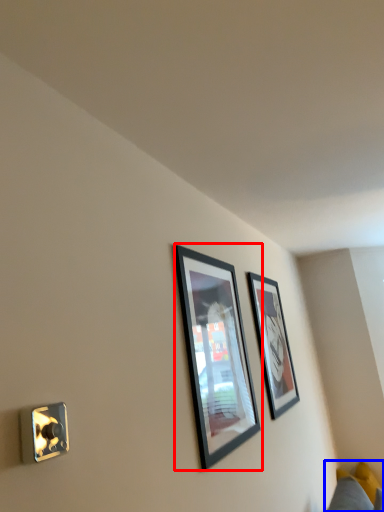
Question: Which of the following is the closest to the observer, picture frame (highlighted by a red box) or couch (highlighted by a blue box)?

Choices:
 (A) picture frame
 (B) couch

Answer: (A)